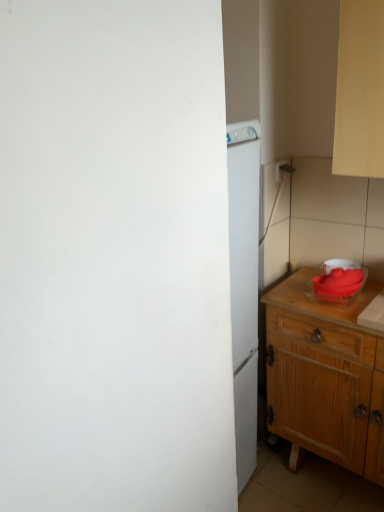
Question: From a real-world perspective, is matte red bowl at right physically above wooden cabinet at right?

Choices:
 (A) no
 (B) yes

Answer: (B)

Question: Are matte red bowl at right and wooden cabinet at right far apart?

Choices:
 (A) no
 (B) yes

Answer: (A)

Question: Is matte red bowl at right shorter than wooden cabinet at right?

Choices:
 (A) no
 (B) yes

Answer: (B)

Question: Considering the relative sizes of matte red bowl at right and wooden cabinet at right in the image provided, is matte red bowl at right thinner than wooden cabinet at right?

Choices:
 (A) no
 (B) yes

Answer: (B)

Question: From the image's perspective, is matte red bowl at right on top of wooden cabinet at right?

Choices:
 (A) no
 (B) yes

Answer: (B)

Question: Does point (274, 177) appear closer or farther from the camera than point (269, 327)?

Choices:
 (A) closer
 (B) farther

Answer: (B)

Question: Relative to wooden cabinet at right, is white plastic electric outlet at upper right in front or behind?

Choices:
 (A) front
 (B) behind

Answer: (B)

Question: Looking at their shapes, would you say white plastic electric outlet at upper right is wider or thinner than wooden cabinet at right?

Choices:
 (A) thin
 (B) wide

Answer: (A)

Question: From a real-world perspective, is white plastic electric outlet at upper right positioned above or below wooden cabinet at right?

Choices:
 (A) above
 (B) below

Answer: (A)

Question: Based on their sizes in the image, would you say wooden cabinet at right is bigger or smaller than white plastic electric outlet at upper right?

Choices:
 (A) big
 (B) small

Answer: (A)

Question: In terms of height, does wooden cabinet at right look taller or shorter compared to white plastic electric outlet at upper right?

Choices:
 (A) short
 (B) tall

Answer: (B)

Question: Based on their positions, is wooden cabinet at right located to the left or right of white plastic electric outlet at upper right?

Choices:
 (A) left
 (B) right

Answer: (B)

Question: Looking at their shapes, would you say wooden cabinet at right is wider or thinner than white plastic electric outlet at upper right?

Choices:
 (A) thin
 (B) wide

Answer: (B)

Question: From the image's perspective, is white plastic electric outlet at upper right positioned above or below matte red bowl at right?

Choices:
 (A) below
 (B) above

Answer: (B)

Question: Relative to matte red bowl at right, is white plastic electric outlet at upper right in front or behind?

Choices:
 (A) front
 (B) behind

Answer: (B)